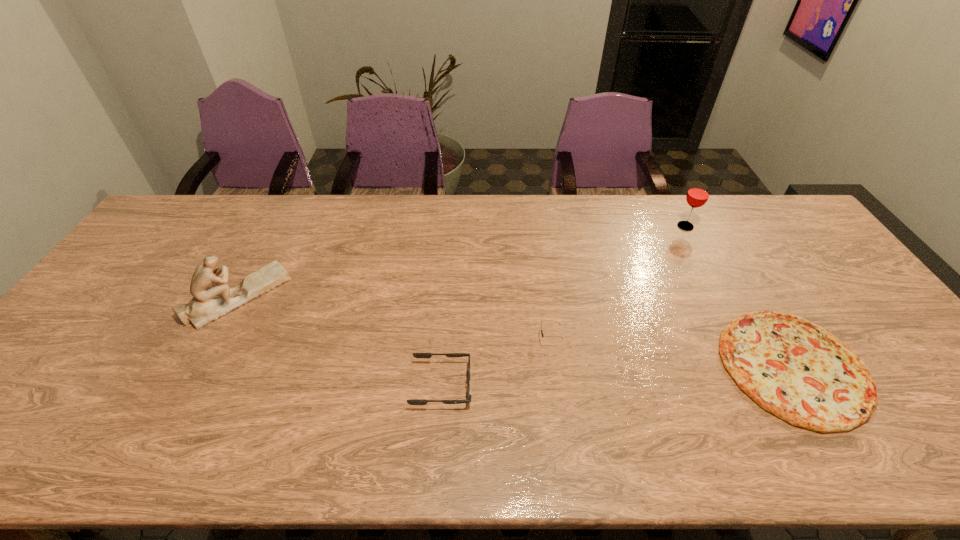
In the image, there is a desktop. Where is `free space at the left edge`? Image resolution: width=960 pixels, height=540 pixels. free space at the left edge is located at coordinates (165, 268).

Locate an element on the screen. The image size is (960, 540). vacant region at the right edge is located at coordinates (826, 264).

The image size is (960, 540). Find the location of `blank space at the far right corner`. blank space at the far right corner is located at coordinates (765, 222).

Identify the location of free region at the near right corner. Image resolution: width=960 pixels, height=540 pixels. (955, 428).

This screenshot has height=540, width=960. Identify the location of free area in between the farthest object and the pizza. (739, 296).

You are a GUI agent. You are given a task and a screenshot of the screen. Output one action in this format:
    pyautogui.click(x=<x>, y=<y>)
    Task: Click on the free space between the farthest object and the fourth object from right to left
    The height and width of the screenshot is (540, 960).
    Given the screenshot: What is the action you would take?
    pyautogui.click(x=564, y=306)

You are a GUI agent. You are given a task and a screenshot of the screen. Output one action in this format:
    pyautogui.click(x=<x>, y=<y>)
    Task: Click on the unoccupied position between the third object from right to left and the shortest object
    This screenshot has width=960, height=540.
    Given the screenshot: What is the action you would take?
    pyautogui.click(x=671, y=353)

I want to click on vacant area that lies between the farthest object and the farther sunglasses, so click(617, 283).

Locate an element on the screen. This screenshot has height=540, width=960. unoccupied position between the third object from right to left and the figurine is located at coordinates (394, 318).

Locate an element on the screen. Image resolution: width=960 pixels, height=540 pixels. free space that is in between the nearer sunglasses and the glass is located at coordinates (564, 306).